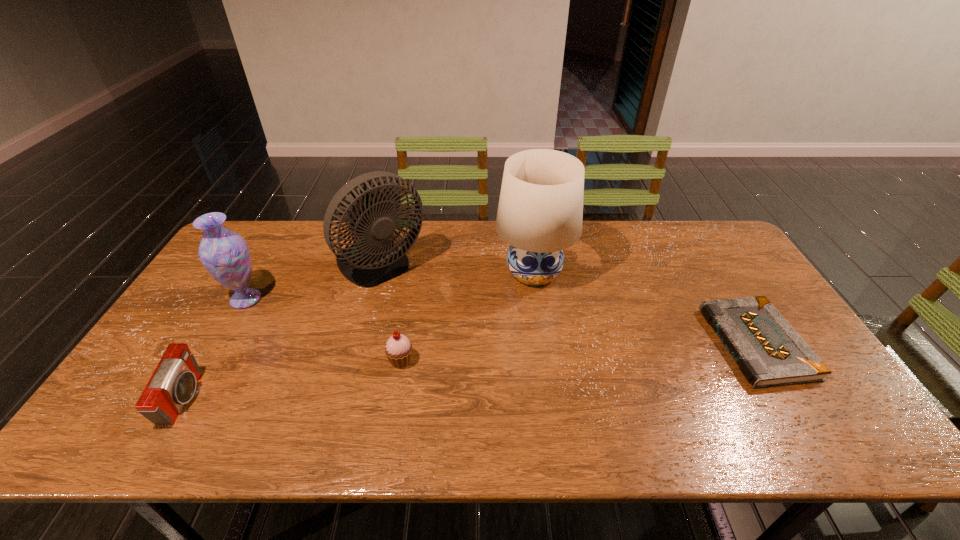
The width and height of the screenshot is (960, 540). I want to click on lampshade, so click(x=540, y=213).

Where is `fan`? fan is located at coordinates (374, 259).

I want to click on vase, so click(x=225, y=254).

This screenshot has width=960, height=540. In order to click on camera in this screenshot , I will do `click(173, 384)`.

Find the location of a particular element. The width and height of the screenshot is (960, 540). cupcake is located at coordinates (398, 349).

Locate an element on the screen. Image resolution: width=960 pixels, height=540 pixels. the shortest object is located at coordinates (769, 352).

Image resolution: width=960 pixels, height=540 pixels. What are the coordinates of `the rightmost object` in the screenshot? It's located at (769, 352).

At what (x,y) coordinates should I click in order to perform the action: click on free region located on the front-facing side of the lampshade. Please return your answer as a coordinate pair (x, y). The image size is (960, 540). Looking at the image, I should click on (547, 372).

Where is `vacant area situated in front of the fan to direct airflow`? This screenshot has width=960, height=540. vacant area situated in front of the fan to direct airflow is located at coordinates (367, 319).

The image size is (960, 540). I want to click on vacant space situated on the front of the vase, so click(204, 373).